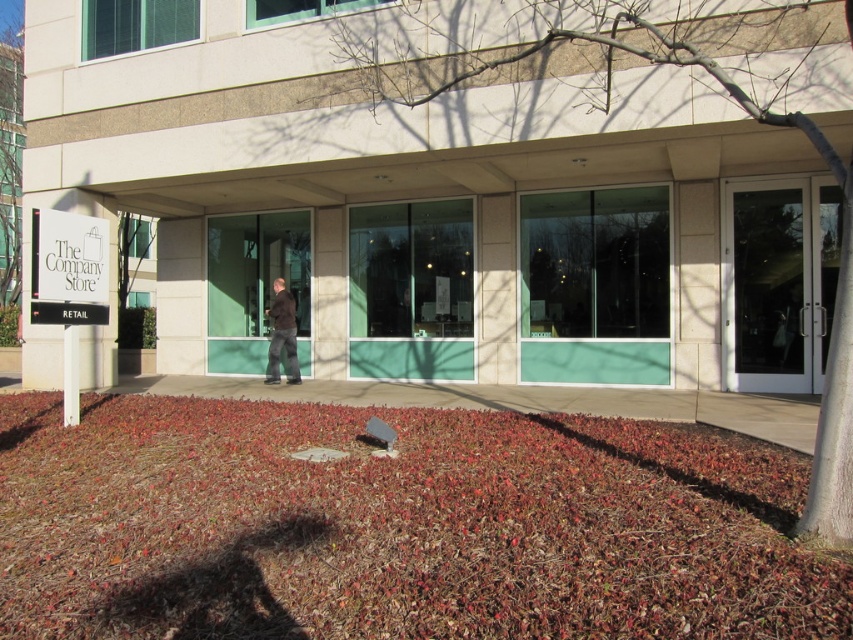
You are a delivery person trying to park your van near the entrance of The Company Store. The van has a side door that needs to open to the right. The parking space is narrow. You notice the white plastic sign at upper left and the dark brown jacket at center. Which object might block the van door when opening, considering their sizes?

The dark brown jacket at center is wider than the white plastic sign at upper left, so it might block the van door when opening.

You are a delivery person approaching the white glass door at right and the white plastic sign at upper left. Which object is closer to you as you approach the building?

The white glass door at right is closer to you because the white plastic sign at upper left is behind it.